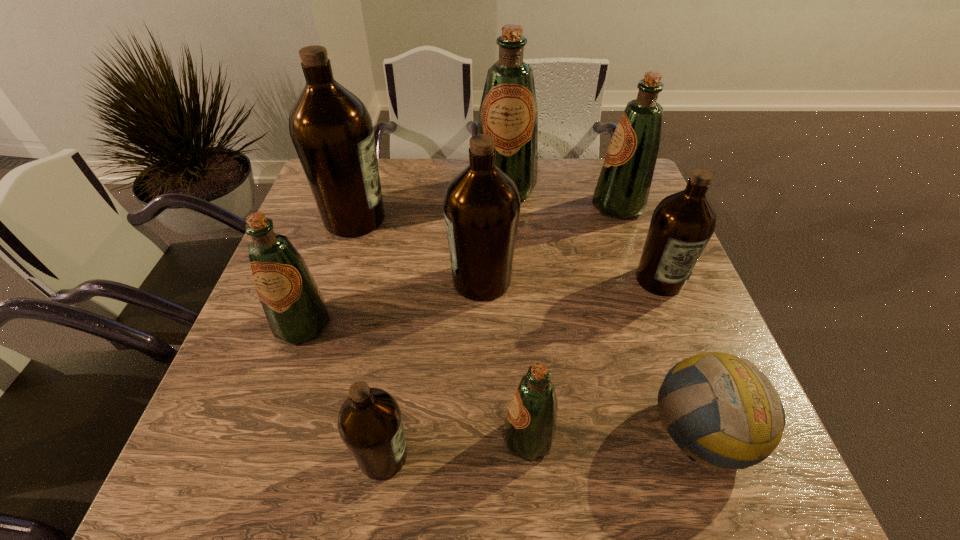
At what (x,y) coordinates should I click in order to perform the action: click on the biggest green olive oil. Please return your answer as a coordinate pair (x, y). The image size is (960, 540). Looking at the image, I should click on (508, 112).

I want to click on the farthest brown olive oil, so click(x=331, y=129).

This screenshot has width=960, height=540. Identify the location of the biggest brown olive oil. (331, 129).

Find the location of `the second biggest green olive oil`. the second biggest green olive oil is located at coordinates (622, 190).

Locate an element on the screen. the second brown olive oil from right to left is located at coordinates (482, 205).

Identify the location of the rightmost brown olive oil. (682, 224).

I want to click on the leftmost green olive oil, so click(x=296, y=311).

At what (x,y) coordinates should I click in order to perform the action: click on the third farthest green olive oil. Please return your answer as a coordinate pair (x, y). This screenshot has width=960, height=540. Looking at the image, I should click on (296, 311).

You are a GUI agent. You are given a task and a screenshot of the screen. Output one action in this format:
    pyautogui.click(x=<x>, y=<y>)
    Task: Click on the smallest green olive oil
    
    Given the screenshot: What is the action you would take?
    pyautogui.click(x=530, y=425)

Where is `the second brown olive oil from left to right`? The width and height of the screenshot is (960, 540). the second brown olive oil from left to right is located at coordinates (370, 424).